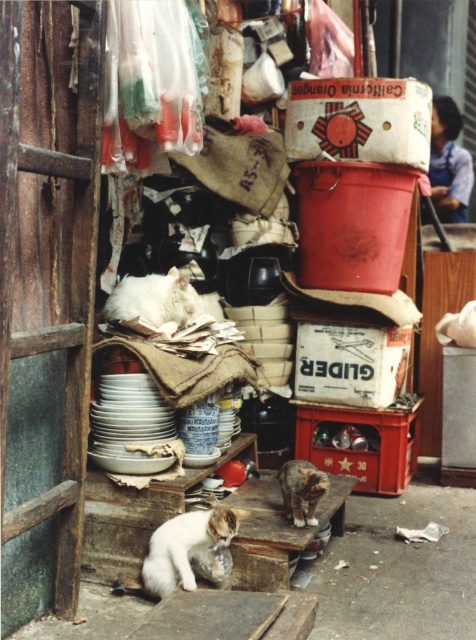
Is white fluffy cat at lower left smaller than tabby fur cat at lower center?

No, white fluffy cat at lower left is not smaller than tabby fur cat at lower center.

Between point (194, 588) and point (290, 486), which one is positioned behind?

The point (290, 486) is more distant.

Is point (188, 579) closer to viewer compared to point (319, 493)?

Yes.

Identify the location of white fluffy cat at lower left. The width and height of the screenshot is (476, 640). (188, 548).

Between white fluffy cat at lower left and white fluffy cat at center, which one has more height?

With more height is white fluffy cat at lower left.

Does point (220, 564) come closer to viewer compared to point (157, 300)?

Yes, it is in front of point (157, 300).

Find the location of a particular element. Image resolution: width=476 pixels, height=640 pixels. white fluffy cat at lower left is located at coordinates (188, 548).

Which is above, white fluffy cat at center or tabby fur cat at lower center?

white fluffy cat at center

Which of these two, white fluffy cat at center or tabby fur cat at lower center, stands taller?

With more height is white fluffy cat at center.

This screenshot has width=476, height=640. What do you see at coordinates (152, 300) in the screenshot?
I see `white fluffy cat at center` at bounding box center [152, 300].

This screenshot has width=476, height=640. I want to click on white fluffy cat at center, so click(152, 300).